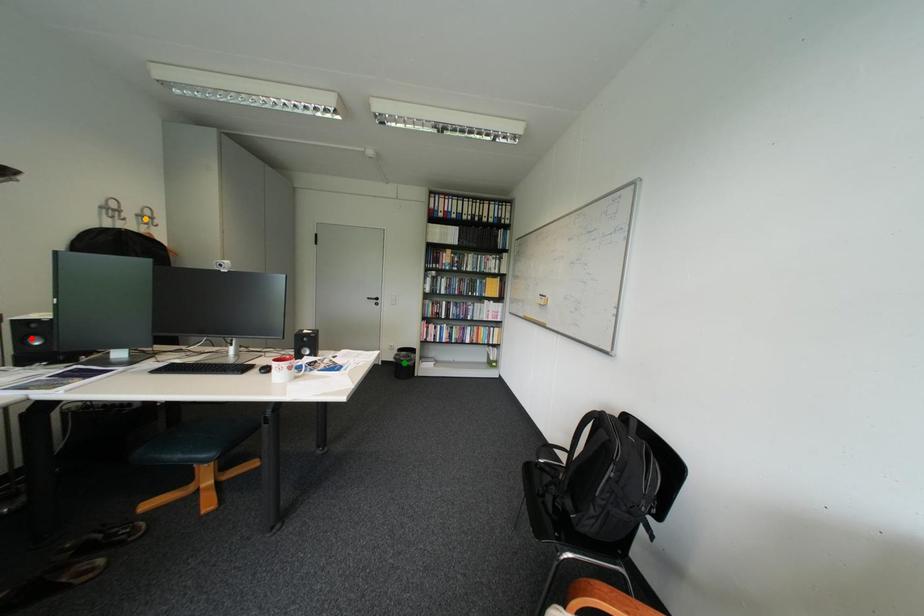
Order these from nearest to farthest:
orange point, red point, green point

red point, orange point, green point